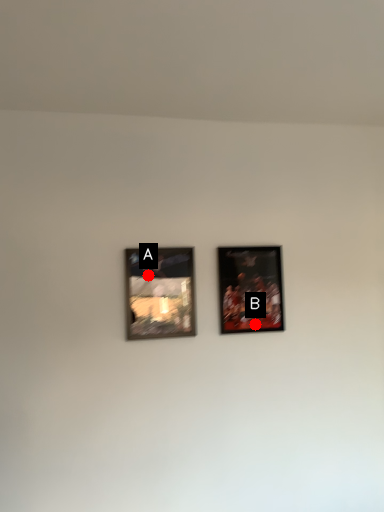
Question: Two points are circled on the image, labeled by A and B beside each circle. Which of the following is the farthest from the observer?

Choices:
 (A) A is further
 (B) B is further

Answer: (B)